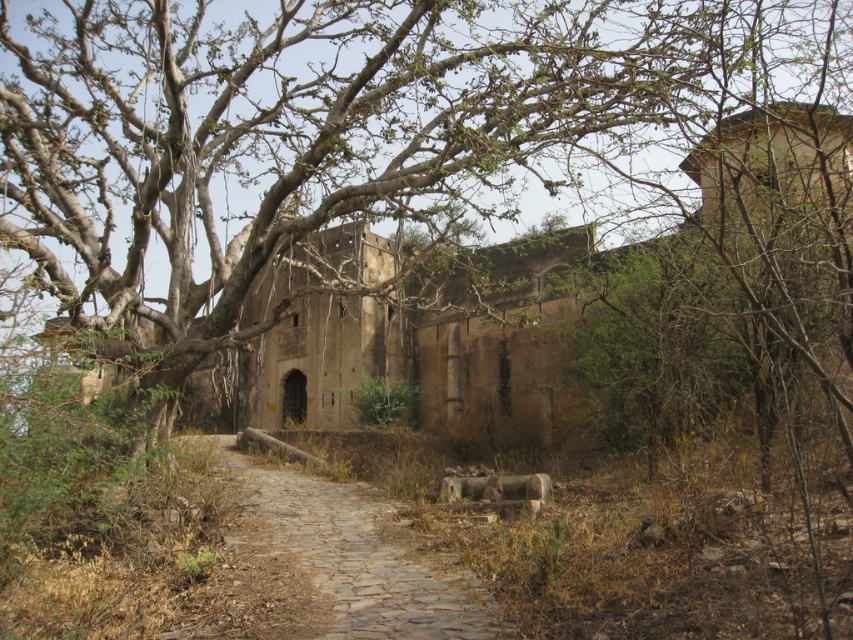
Is brown stone path at center below rusty metallic barrel at center?

Correct, brown stone path at center is located below rusty metallic barrel at center.

Does brown stone path at center appear over rusty metallic barrel at center?

No.

Who is more distant from viewer, (367, 625) or (486, 483)?

Point (486, 483)

Locate an element on the screen. brown stone path at center is located at coordinates (360, 556).